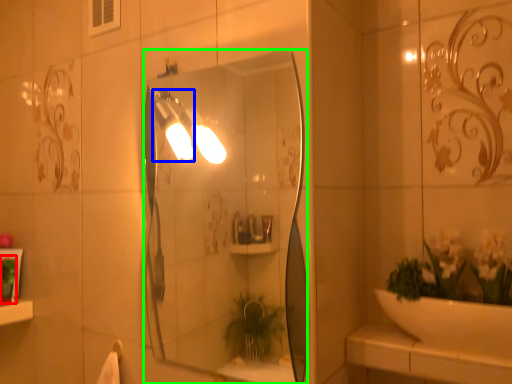
Question: Which object is positioned farthest from toiletry (highlighted by a red box)? Select from light fixture (highlighted by a blue box) and mirror (highlighted by a green box).

Choices:
 (A) light fixture
 (B) mirror

Answer: (B)